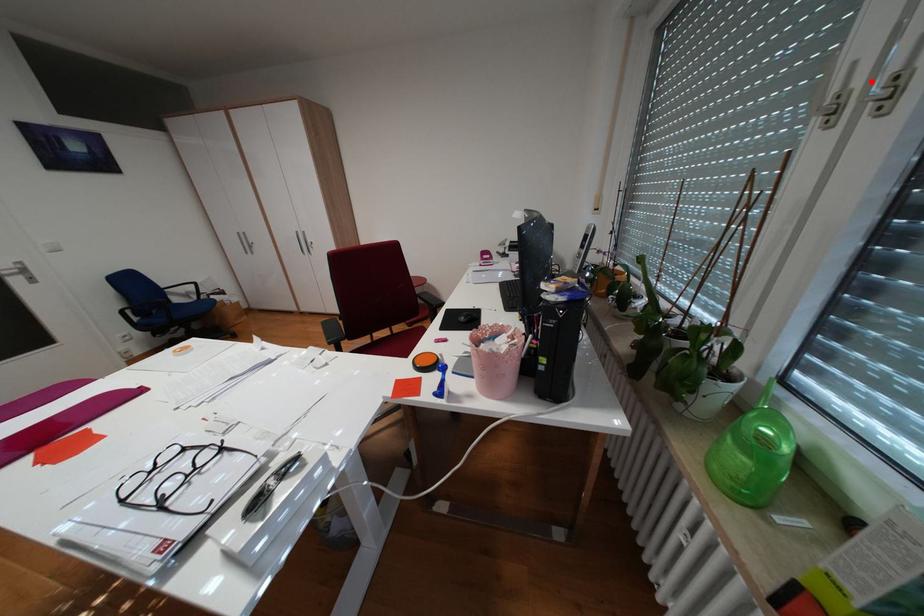
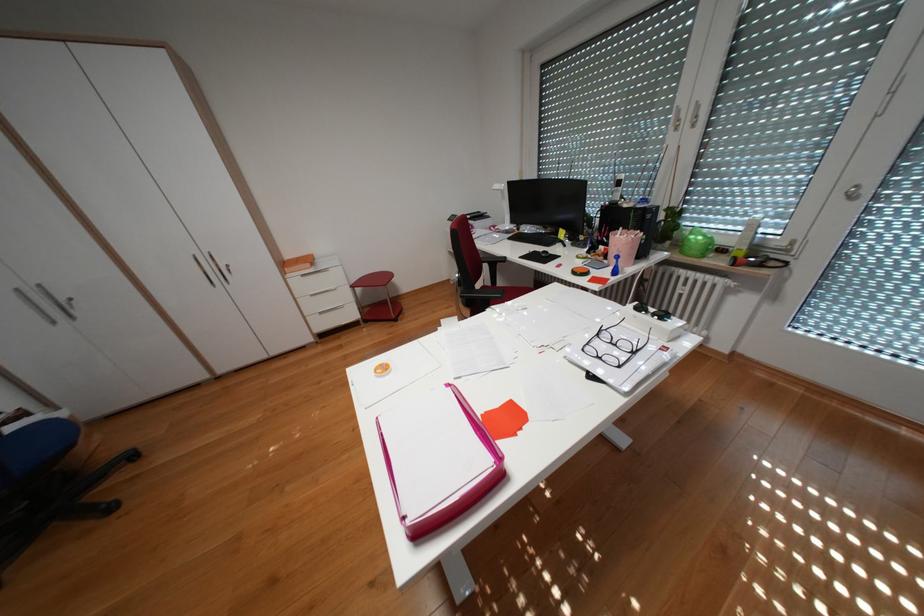
In the second image, find the point that corresponds to the highlighted location in the first image.

(695, 116)